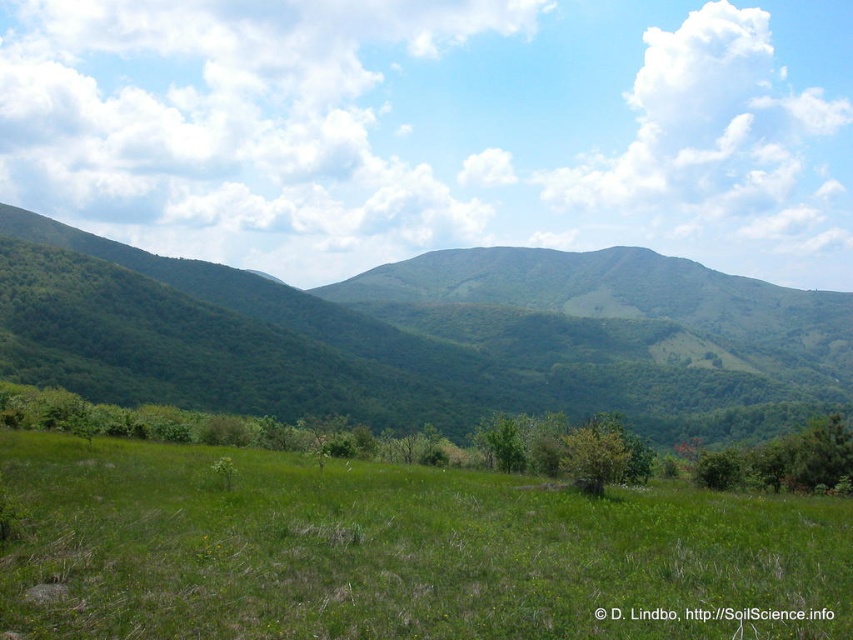
Question: Which point is farther to the camera?

Choices:
 (A) green leafy tree at center
 (B) green leafy mountain at center

Answer: (B)

Question: Which point is closer to the camera?

Choices:
 (A) green leafy mountain at center
 (B) green leafy tree at center

Answer: (B)

Question: Is green grassy field at center positioned before green leafy tree at center?

Choices:
 (A) no
 (B) yes

Answer: (B)

Question: Is the position of green grassy field at center more distant than that of green leafy tree at center?

Choices:
 (A) no
 (B) yes

Answer: (A)

Question: Which object appears closest to the camera in this image?

Choices:
 (A) green grassy field at center
 (B) green leafy tree at center

Answer: (A)

Question: Can you confirm if green leafy mountain at center is thinner than green leafy tree at center?

Choices:
 (A) yes
 (B) no

Answer: (B)